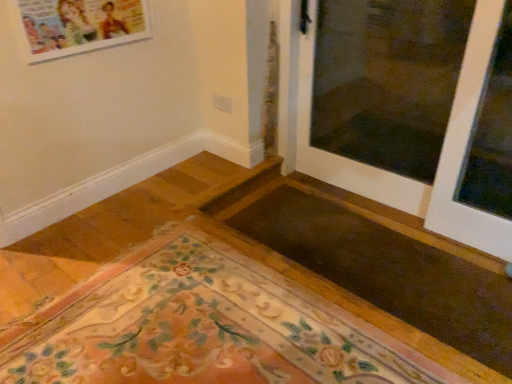
Question: In terms of size, does transparent glass window at right appear bigger or smaller than floral carpet at lower left?

Choices:
 (A) big
 (B) small

Answer: (B)

Question: From the image's perspective, is transparent glass window at right above or below floral carpet at lower left?

Choices:
 (A) above
 (B) below

Answer: (A)

Question: Considering the real-world distances, which object is closest to the white glossy door at upper right?

Choices:
 (A) transparent glass window at right
 (B) floral carpet at lower left

Answer: (A)

Question: Which is nearer to the white glossy door at upper right?

Choices:
 (A) transparent glass window at right
 (B) floral carpet at lower left

Answer: (A)